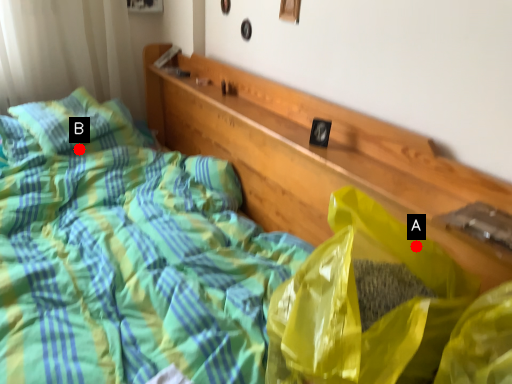
Question: Two points are circled on the image, labeled by A and B beside each circle. Which of the following is the closest to the observer?

Choices:
 (A) A is closer
 (B) B is closer

Answer: (A)